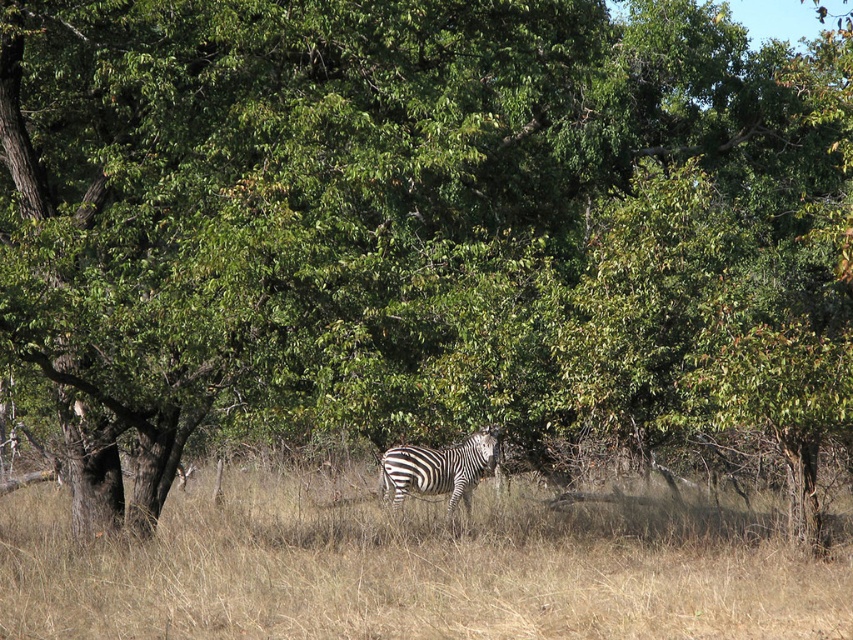
You are a safari guide leading a tour in a grassland. You see the dry grass at center and the black and white striped zebra at center. Which object is taller?

The black and white striped zebra at center is taller than the dry grass at center.

Looking at this image, you are navigating through the dense thicket and want to reach the zebra. There are two points marked in the scene, point A at coordinates point (625, 560) and point B at coordinates point (409, 464). Which point should you approach first to get closer to the zebra?

Point A at coordinates point (625, 560) is closer to the viewer than point B at coordinates point (409, 464). Therefore, approaching point A first would get you closer to the zebra since it is nearer to your current position.